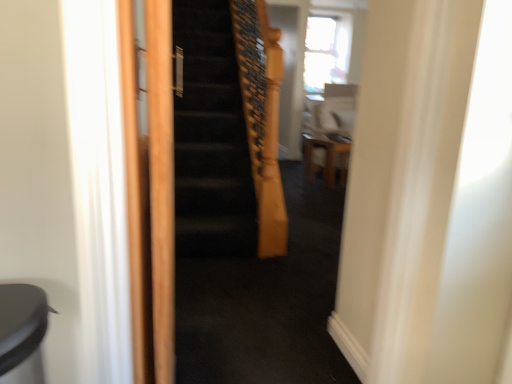
Question: Is wooden stool at center surrounded by wooden screen door at center?

Choices:
 (A) yes
 (B) no

Answer: (B)

Question: From a real-world perspective, is wooden screen door at center physically below wooden stool at center?

Choices:
 (A) no
 (B) yes

Answer: (A)

Question: From the image's perspective, is wooden screen door at center over wooden stool at center?

Choices:
 (A) yes
 (B) no

Answer: (B)

Question: Considering the relative positions of wooden screen door at center and wooden stool at center in the image provided, is wooden screen door at center to the right of wooden stool at center from the viewer's perspective?

Choices:
 (A) no
 (B) yes

Answer: (A)

Question: Is wooden screen door at center not inside wooden stool at center?

Choices:
 (A) yes
 (B) no

Answer: (A)

Question: Can you confirm if wooden screen door at center is thinner than wooden stool at center?

Choices:
 (A) yes
 (B) no

Answer: (A)

Question: Is wooden stool at center completely or partially outside of wooden screen door at center?

Choices:
 (A) no
 (B) yes

Answer: (B)

Question: Could you tell me if wooden stool at center is turned towards wooden screen door at center?

Choices:
 (A) no
 (B) yes

Answer: (A)

Question: From a real-world perspective, is wooden stool at center below wooden screen door at center?

Choices:
 (A) yes
 (B) no

Answer: (A)

Question: From a real-world perspective, does wooden stool at center stand above wooden screen door at center?

Choices:
 (A) no
 (B) yes

Answer: (A)

Question: Is wooden stool at center looking in the opposite direction of wooden screen door at center?

Choices:
 (A) no
 (B) yes

Answer: (A)

Question: Does wooden stool at center appear on the left side of wooden screen door at center?

Choices:
 (A) no
 (B) yes

Answer: (A)

Question: From the image's perspective, is wooden screen door at center located above or below wooden stool at center?

Choices:
 (A) above
 (B) below

Answer: (B)